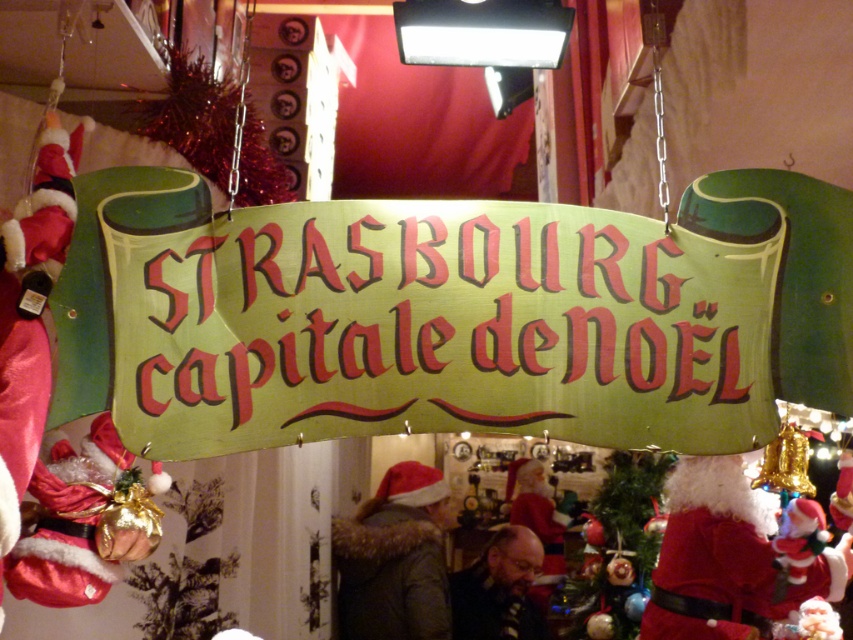
You are standing in the festive market and need to locate the green paper sign at center. According to the coordinates provided, where exactly is the green paper sign positioned?

The green paper sign at center is located at point (444,324).